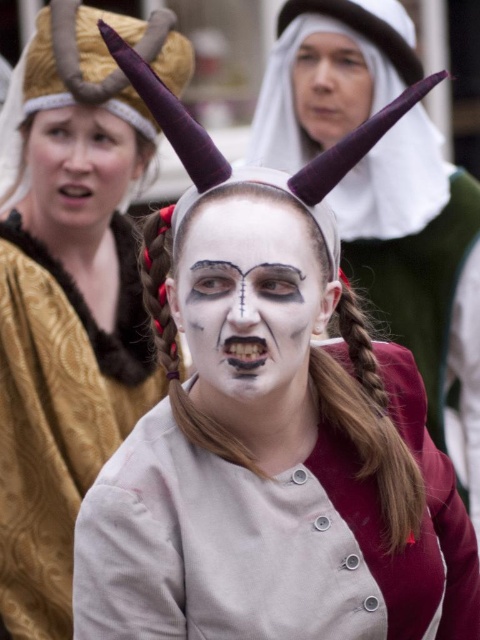
Is white matte face paint at center smaller than matte gold headband at upper left?

No.

Based on the photo, measure the distance between white matte face paint at center and camera.

The distance of white matte face paint at center from camera is 13.09 meters.

Who is more distant from viewer, (92, 333) or (27, 168)?

Point (27, 168)

Locate an element on the screen. Image resolution: width=480 pixels, height=640 pixels. white matte face paint at center is located at coordinates (71, 298).

Looking at this image, does white matte face at center appear under matte gold headband at upper left?

Indeed, white matte face at center is positioned under matte gold headband at upper left.

Between white matte face at center and matte gold headband at upper left, which one is positioned higher?

matte gold headband at upper left is above.

Does point (206, 225) come in front of point (103, 195)?

That is True.

Find the location of `white matte face at center`. white matte face at center is located at coordinates (249, 296).

Who is shorter, white matte face paint at center or smooth white face at upper center?

Standing shorter between the two is smooth white face at upper center.

Is white matte face paint at center wider than smooth white face at upper center?

Indeed, white matte face paint at center has a greater width compared to smooth white face at upper center.

Find the location of a particular element. The height and width of the screenshot is (640, 480). white matte face paint at center is located at coordinates (71, 298).

You are a GUI agent. You are given a task and a screenshot of the screen. Output one action in this format:
    pyautogui.click(x=<x>, y=<y>)
    Task: Click on the white matte face paint at center
    
    Given the screenshot: What is the action you would take?
    pyautogui.click(x=71, y=298)